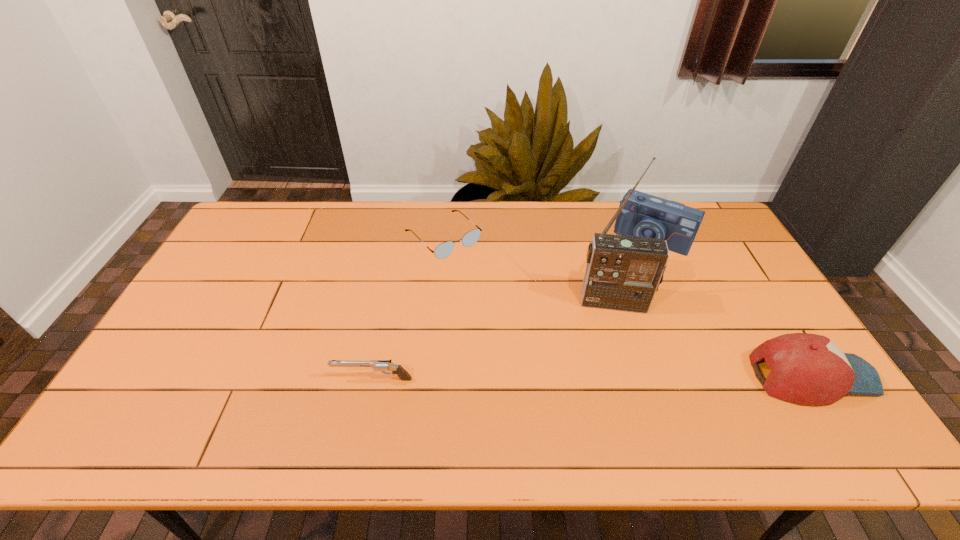
Where is `pistol that is at the near edge`? This screenshot has height=540, width=960. pistol that is at the near edge is located at coordinates (378, 365).

Where is `baseball cap at the near edge`? This screenshot has height=540, width=960. baseball cap at the near edge is located at coordinates (807, 369).

Locate an element on the screen. baseball cap that is at the right edge is located at coordinates (807, 369).

Identify the location of camera that is at the right edge. [644, 215].

Locate an element on the screen. object that is at the far right corner is located at coordinates (644, 215).

The width and height of the screenshot is (960, 540). I want to click on object that is at the near right corner, so click(x=807, y=369).

I want to click on vacant space at the far edge of the desktop, so click(358, 226).

Image resolution: width=960 pixels, height=540 pixels. I want to click on free space at the near edge of the desktop, so click(687, 384).

Identify the location of vacant space at the left edge. Image resolution: width=960 pixels, height=540 pixels. (200, 293).

This screenshot has height=540, width=960. Identify the location of vacant space at the right edge of the desktop. (708, 266).